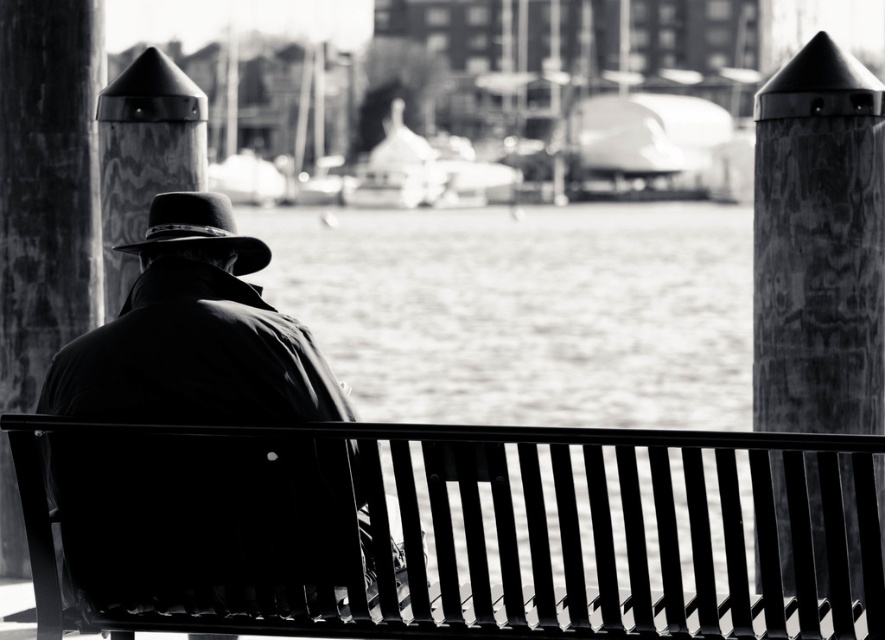
Question: Which point appears farthest from the camera in this image?

Choices:
 (A) (332, 456)
 (B) (165, 234)
 (C) (791, 138)
 (D) (139, 128)

Answer: (D)

Question: Does silhouette woolen coat at center have a greater width compared to smooth concrete post at left?

Choices:
 (A) yes
 (B) no

Answer: (A)

Question: Which is nearer to the metallic black bench at center?

Choices:
 (A) silhouette woolen coat at center
 (B) smooth wood post at center left
 (C) wooden textured post at right

Answer: (A)

Question: Does wooden textured post at right have a larger size compared to felt fedora at center?

Choices:
 (A) yes
 (B) no

Answer: (A)

Question: Does smooth concrete post at left lie in front of smooth wood post at center left?

Choices:
 (A) no
 (B) yes

Answer: (A)

Question: Which object appears closest to the camera in this image?

Choices:
 (A) felt fedora at center
 (B) silhouette woolen coat at center
 (C) metallic black bench at center

Answer: (C)